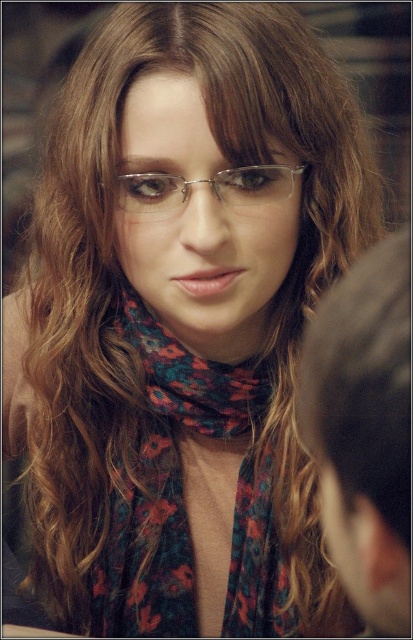
Is brown hair at upper right in front of clear plastic glasses at center?

Yes, brown hair at upper right is closer to the viewer.

Is point (377, 321) behind point (256, 188)?

No, (377, 321) is in front of (256, 188).

Measure the distance between point [401,580] and camera.

Point [401,580] is 10.16 inches from camera.

This screenshot has height=640, width=413. Identify the location of brown hair at upper right. (363, 429).

Who is more forward, [130,632] or [403,602]?

Point [403,602] is more forward.

Is floral print scarf at center above brown hair at upper right?

No.

Is point (184, 557) behind point (356, 518)?

Yes, point (184, 557) is farther from viewer.

You are a GUI agent. You are given a task and a screenshot of the screen. Output one action in this format:
    pyautogui.click(x=<x>, y=<y>)
    Task: Click on the floral print scarf at center
    
    Given the screenshot: What is the action you would take?
    click(x=166, y=481)

Who is taller, floral print scarf at center or clear plastic glasses at center?

floral print scarf at center is taller.

Which is behind, point (95, 611) or point (199, 179)?

The point (95, 611) is more distant.

Identify the location of floral print scarf at center. This screenshot has width=413, height=640. (166, 481).